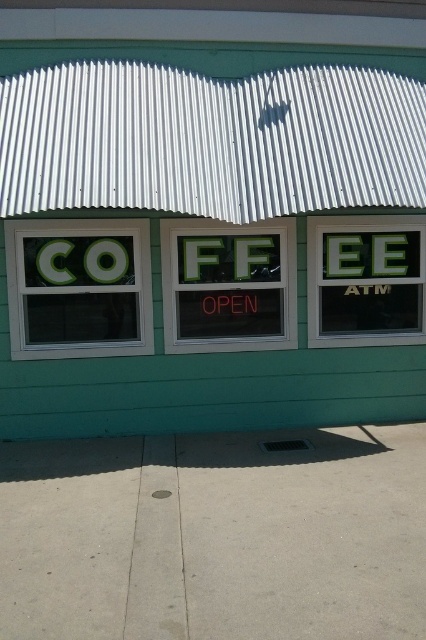
Question: Which of these objects is positioned farthest from the green plastic sign at left?

Choices:
 (A) green matte atm sign at right
 (B) green matte signboard at center

Answer: (A)

Question: Is green plastic sign at left positioned in front of green matte atm sign at right?

Choices:
 (A) yes
 (B) no

Answer: (A)

Question: Is green matte signboard at center smaller than green matte atm sign at right?

Choices:
 (A) yes
 (B) no

Answer: (B)

Question: Can you confirm if green matte signboard at center is smaller than green plastic sign at left?

Choices:
 (A) yes
 (B) no

Answer: (B)

Question: Which is nearer to the green glass window at center?

Choices:
 (A) green plastic sign at left
 (B) green matte atm sign at right

Answer: (B)

Question: Estimate the real-world distances between objects in this image. Which object is closer to the green plastic sign at left?

Choices:
 (A) green matte atm sign at right
 (B) green glass window at center
 (C) green matte signboard at center

Answer: (B)